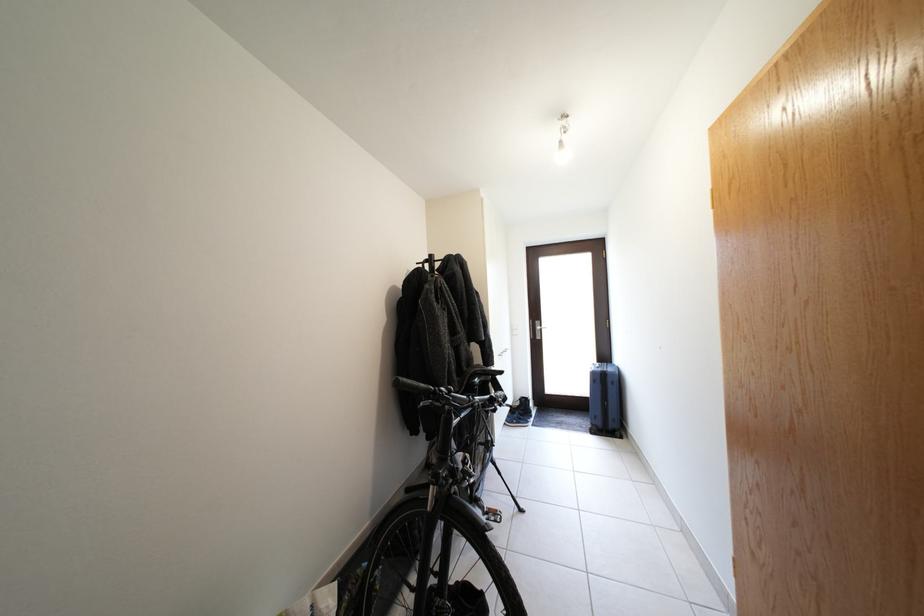
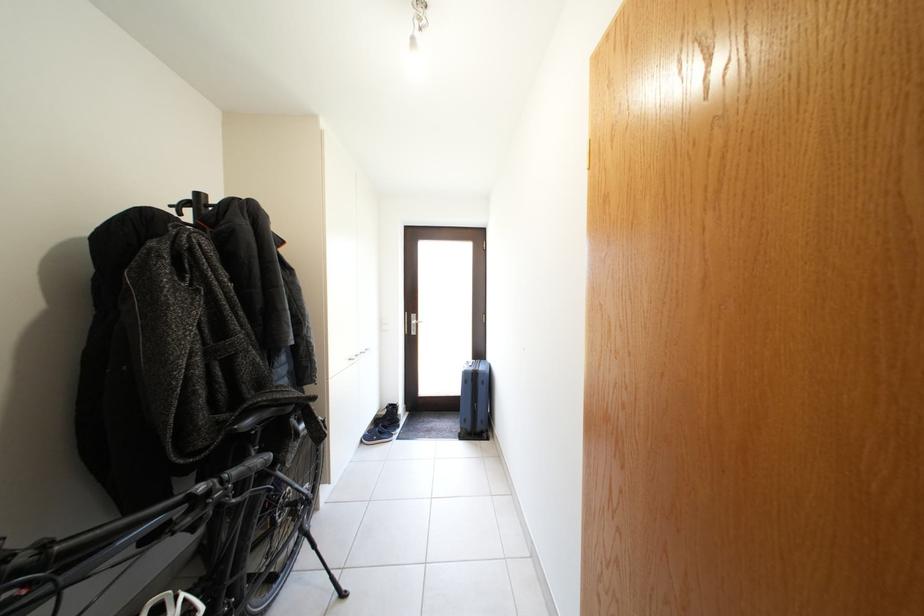
Locate, in the second image, the point that corresponds to point (545, 328) in the first image.

(421, 322)